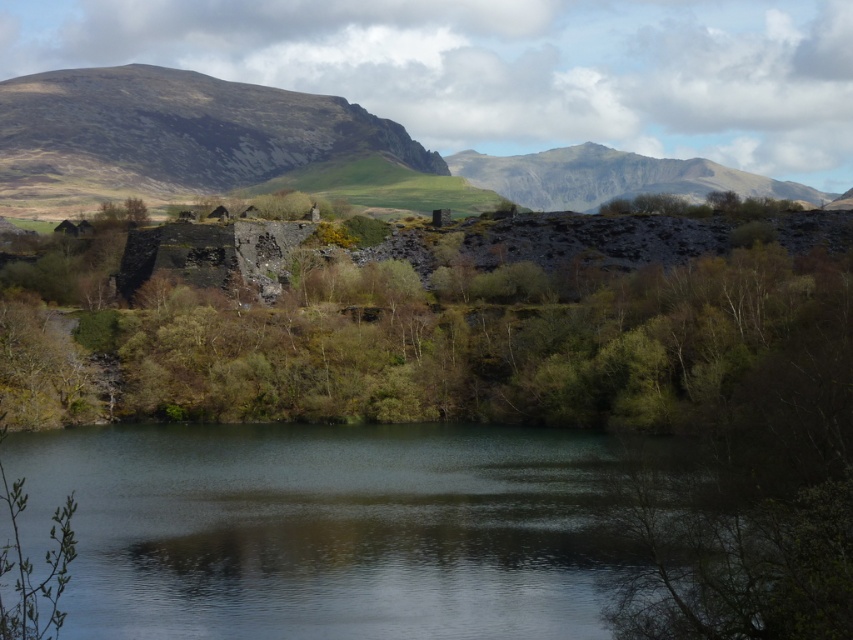
Question: Can you confirm if greenish reflective water at center is positioned to the right of smooth gray rock at upper center?

Choices:
 (A) yes
 (B) no

Answer: (B)

Question: Can you confirm if green leafy tree at center is positioned to the right of smooth gray rock at upper center?

Choices:
 (A) yes
 (B) no

Answer: (B)

Question: Which point appears closest to the camera in this image?

Choices:
 (A) (555, 380)
 (B) (131, 141)
 (C) (695, 172)
 (D) (556, 576)

Answer: (D)

Question: Which of the following is the closest to the observer?

Choices:
 (A) (434, 516)
 (B) (647, 392)
 (C) (532, 180)

Answer: (A)

Question: Does greenish reflective water at center have a greater width compared to green leafy tree at center?

Choices:
 (A) yes
 (B) no

Answer: (B)

Question: Which point is closer to the camera?

Choices:
 (A) greenish reflective water at center
 (B) rugged stone mountain at upper left
 (C) green leafy tree at center

Answer: (A)